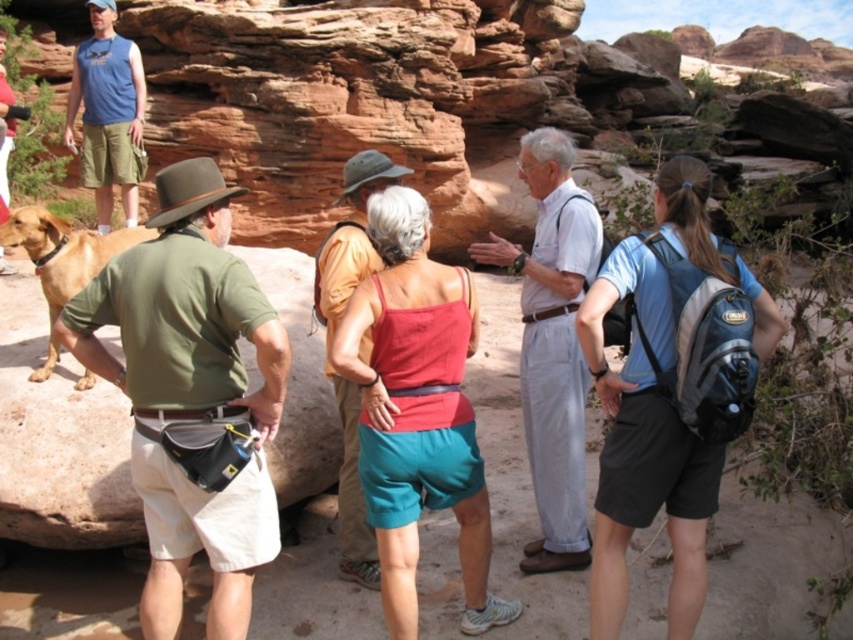
Question: Among these objects, which one is farthest from the camera?

Choices:
 (A) blue fabric backpack at center-right
 (B) matte red tank top at center
 (C) white cotton shirt at center

Answer: (C)

Question: Is blue fabric backpack at center-right to the right of golden brown fur at left from the viewer's perspective?

Choices:
 (A) no
 (B) yes

Answer: (B)

Question: Which point is farther to the camera?

Choices:
 (A) blue fabric backpack at center-right
 (B) reddish-brown fabric tank top at center

Answer: (B)

Question: Can you confirm if blue fabric backpack at center-right is positioned to the right of reddish-brown fabric tank top at center?

Choices:
 (A) yes
 (B) no

Answer: (A)

Question: Among these objects, which one is farthest from the camera?

Choices:
 (A) white cotton shirt at center
 (B) golden brown fur at left
 (C) reddish-brown fabric tank top at center

Answer: (B)

Question: Is blue fabric backpack at center-right closer to the viewer compared to reddish-brown fabric tank top at center?

Choices:
 (A) no
 (B) yes

Answer: (B)